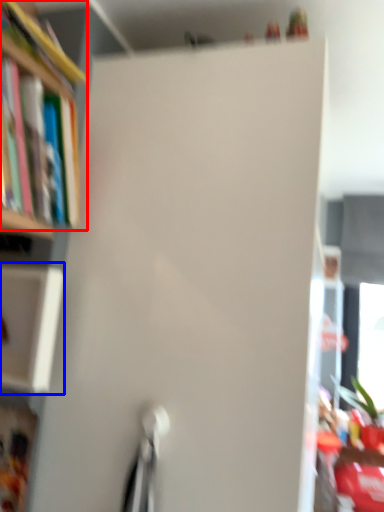
Question: Which of the following is the closest to the observer, book (highlighted by a red box) or cabinet (highlighted by a blue box)?

Choices:
 (A) book
 (B) cabinet

Answer: (A)